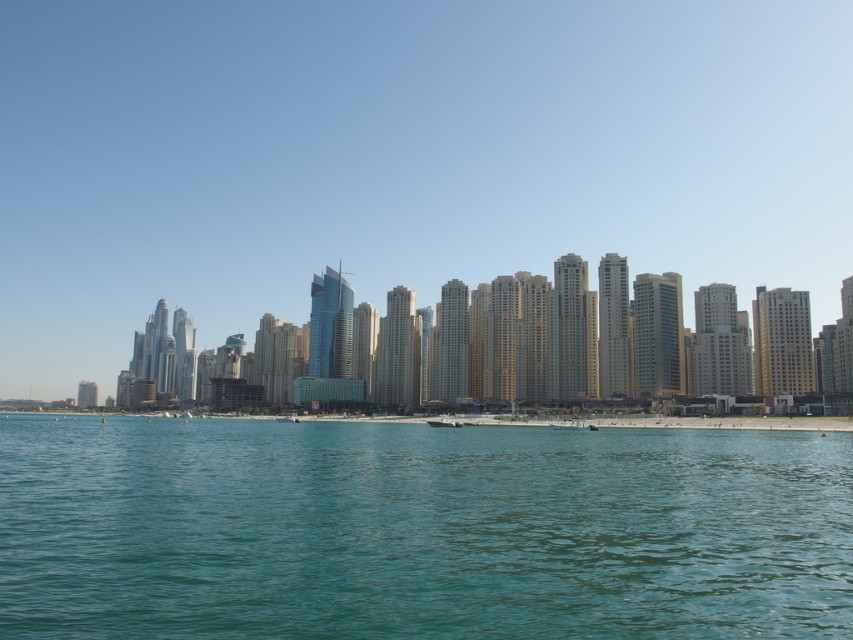
Does clear blue water at center lie in front of white matte boat at lower center?

Yes, it is in front of white matte boat at lower center.

Which is in front, point (837, 560) or point (572, 428)?

Point (837, 560) is more forward.

Is point (440, 465) in front of point (577, 420)?

Yes, point (440, 465) is closer to viewer.

This screenshot has width=853, height=640. Find the location of `clear blue water at center`. clear blue water at center is located at coordinates (419, 531).

Is clear blue water at center taller than white glossy boat at center?

Indeed, clear blue water at center has a greater height compared to white glossy boat at center.

Which of these two, clear blue water at center or white glossy boat at center, stands shorter?

With less height is white glossy boat at center.

The image size is (853, 640). What do you see at coordinates (419, 531) in the screenshot?
I see `clear blue water at center` at bounding box center [419, 531].

I want to click on clear blue water at center, so click(419, 531).

Does white matte boat at lower center come behind white glossy boat at center?

No, white matte boat at lower center is in front of white glossy boat at center.

This screenshot has height=640, width=853. What do you see at coordinates (573, 426) in the screenshot?
I see `white matte boat at lower center` at bounding box center [573, 426].

The image size is (853, 640). What are the coordinates of `white matte boat at lower center` in the screenshot? It's located at (573, 426).

You are a GUI agent. You are given a task and a screenshot of the screen. Output one action in this format:
    pyautogui.click(x=<x>, y=<y>)
    Task: Click on the white matte boat at lower center
    This screenshot has width=853, height=640.
    Given the screenshot: What is the action you would take?
    pyautogui.click(x=573, y=426)